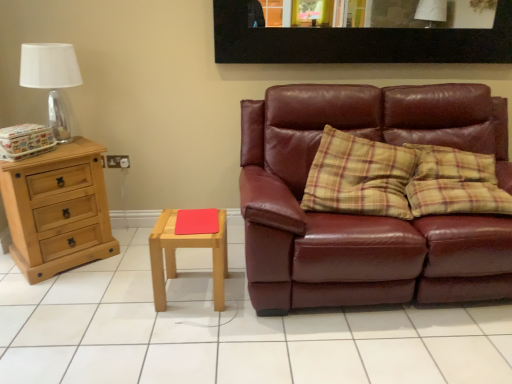
Question: Would you say light brown wooden stool at center is outside matte leather couch at right?

Choices:
 (A) no
 (B) yes

Answer: (B)

Question: From the image's perspective, is light brown wooden stool at center over matte leather couch at right?

Choices:
 (A) yes
 (B) no

Answer: (B)

Question: Is light brown wooden stool at center taller than matte leather couch at right?

Choices:
 (A) yes
 (B) no

Answer: (B)

Question: Considering the relative positions of light brown wooden stool at center and matte leather couch at right in the image provided, is light brown wooden stool at center to the left of matte leather couch at right from the viewer's perspective?

Choices:
 (A) yes
 (B) no

Answer: (A)

Question: Is light brown wooden stool at center shorter than matte leather couch at right?

Choices:
 (A) yes
 (B) no

Answer: (A)

Question: Is the position of light brown wooden stool at center less distant than that of matte leather couch at right?

Choices:
 (A) no
 (B) yes

Answer: (A)

Question: From the image's perspective, is natural wood chest of drawers at left above transparent glass table lamp at upper left?

Choices:
 (A) yes
 (B) no

Answer: (B)

Question: Does natural wood chest of drawers at left turn towards transparent glass table lamp at upper left?

Choices:
 (A) yes
 (B) no

Answer: (B)

Question: From a real-world perspective, does natural wood chest of drawers at left stand above transparent glass table lamp at upper left?

Choices:
 (A) no
 (B) yes

Answer: (A)

Question: Can you confirm if natural wood chest of drawers at left is wider than transparent glass table lamp at upper left?

Choices:
 (A) no
 (B) yes

Answer: (B)

Question: Is natural wood chest of drawers at left positioned behind transparent glass table lamp at upper left?

Choices:
 (A) yes
 (B) no

Answer: (B)

Question: Is natural wood chest of drawers at left touching transparent glass table lamp at upper left?

Choices:
 (A) yes
 (B) no

Answer: (B)

Question: Is black matte picture frame at upper center completely or partially inside white tile at center?

Choices:
 (A) yes
 (B) no

Answer: (B)